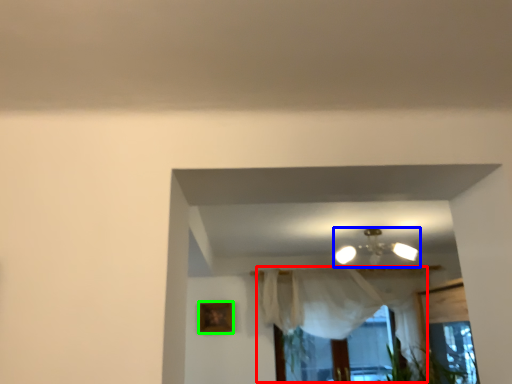
Question: Which object is positioned closest to curtain (highlighted by a red box)? Select from lamp (highlighted by a blue box) and picture frame (highlighted by a green box).

Choices:
 (A) lamp
 (B) picture frame

Answer: (A)